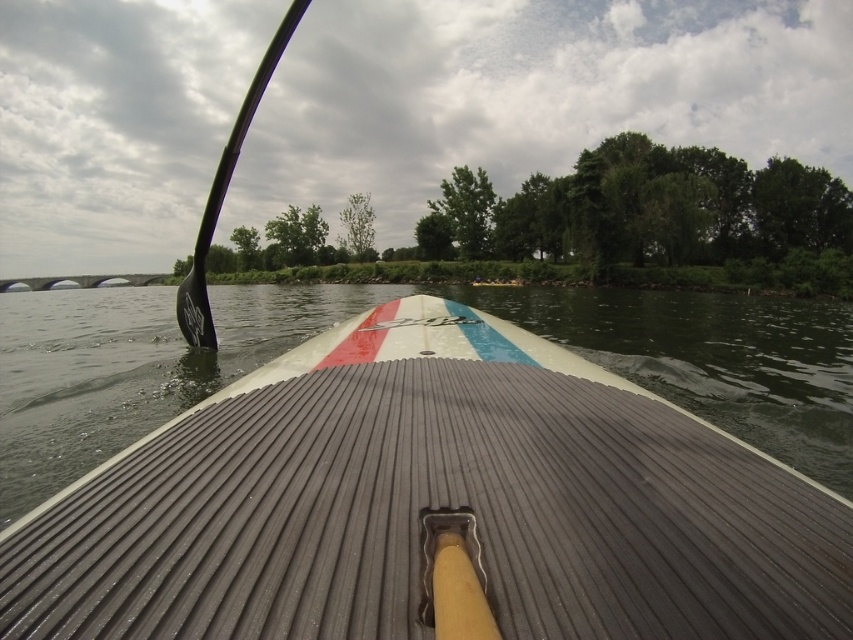
You are on a paddleboard and want to reach the bridge on the left. Which object is closer to you, the smooth gray paddleboard at center or the black rubber paddle at left?

The smooth gray paddleboard at center is closer to you because it is in front of the black rubber paddle at left.

You are on a paddleboard and want to reach the bridge on the left side of the water. Based on your position relative to the smooth gray paddleboard at center, which direction should you paddle to get closer to the bridge?

Since the smooth gray paddleboard at center is located at point (431, 506), you should paddle to the left to reach the bridge on the left side of the water.

You are trying to balance on the smooth gray paddleboard at center while holding the black rubber paddle at left. Which object is wider?

The black rubber paddle at left is wider than the smooth gray paddleboard at center.